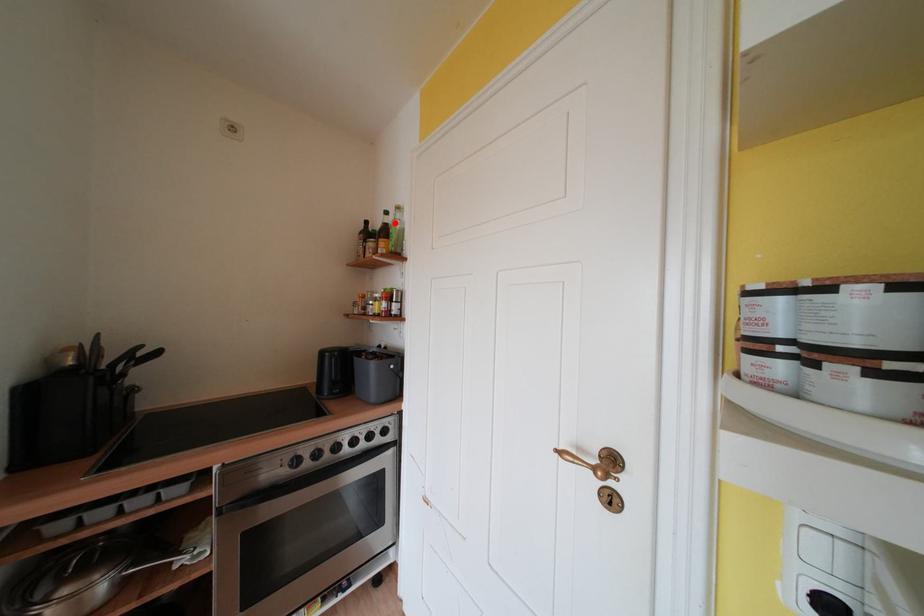
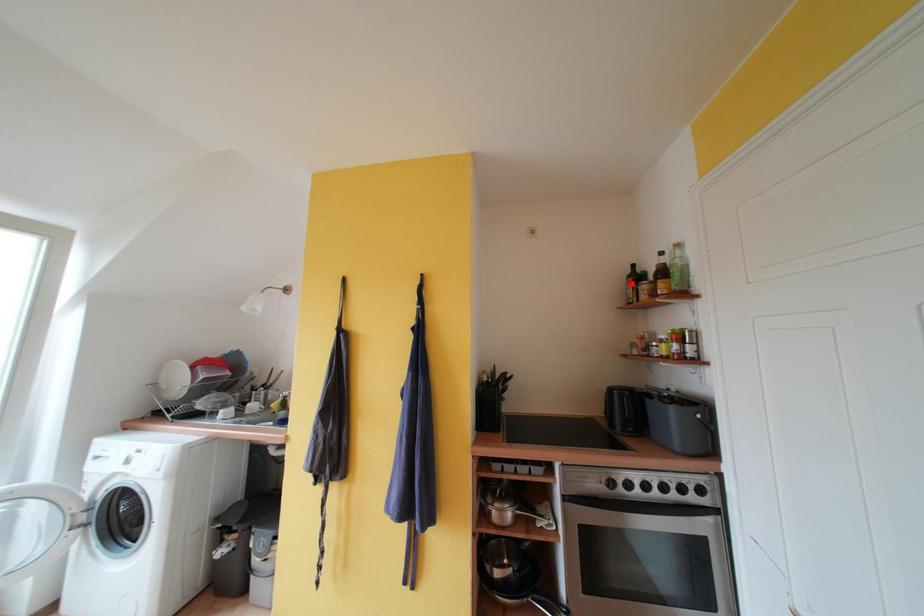
I am providing you with two images of the same scene from different viewpoints. A red point is marked on the first image and another point is marked on the second image. Does the point marked in image1 correspond to the same location as the one in image2?

No